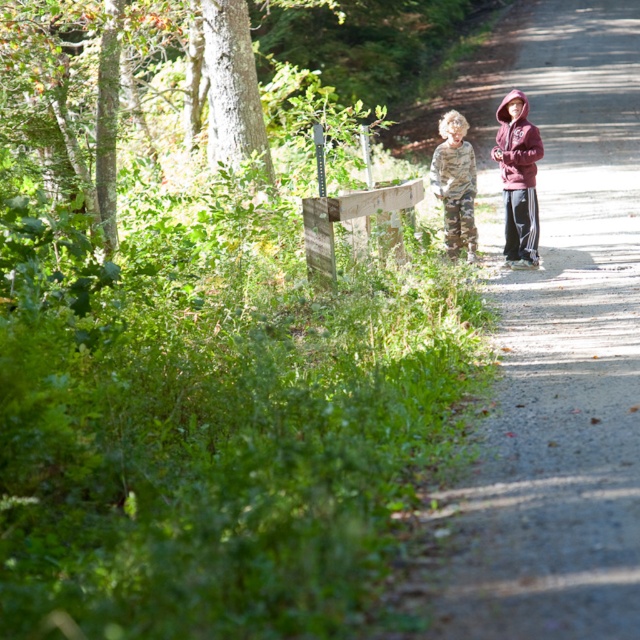
Question: Which point is closer to the camera?

Choices:
 (A) (476, 240)
 (B) (417, 193)

Answer: (B)

Question: Is weathered wooden post at center above maroon fleece jacket at right?

Choices:
 (A) yes
 (B) no

Answer: (B)

Question: Among these points, which one is farthest from the camera?

Choices:
 (A) (500, 168)
 (B) (317, 244)
 (C) (458, 244)
 (D) (461, 163)

Answer: (D)

Question: Which object is closer to the camera taking this photo?

Choices:
 (A) camo fabric jacket at center
 (B) gravel path at center

Answer: (B)

Question: Is camouflage pants at center positioned in front of weathered wooden post at center?

Choices:
 (A) yes
 (B) no

Answer: (B)

Question: Does maroon fleece jacket at right have a smaller size compared to camo fabric jacket at center?

Choices:
 (A) no
 (B) yes

Answer: (A)